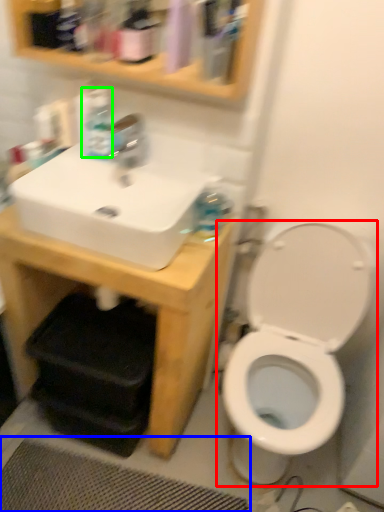
Question: Which object is positioned closest to toilet (highlighted by a red box)? Select from bath mat (highlighted by a blue box) and bottle (highlighted by a green box).

Choices:
 (A) bath mat
 (B) bottle

Answer: (A)